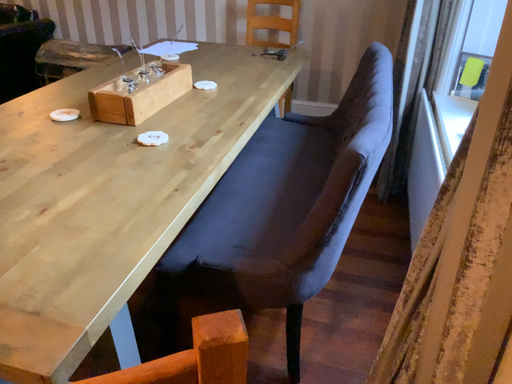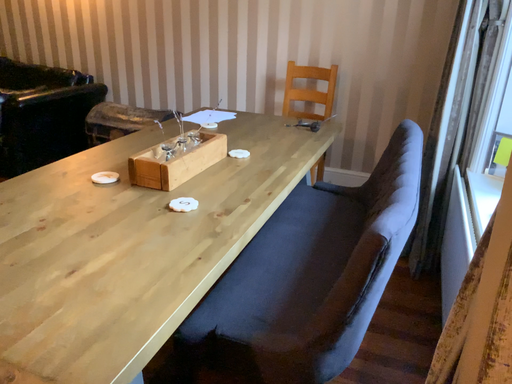
Question: How did the camera likely rotate when shooting the video?

Choices:
 (A) rotated downward
 (B) rotated upward

Answer: (B)